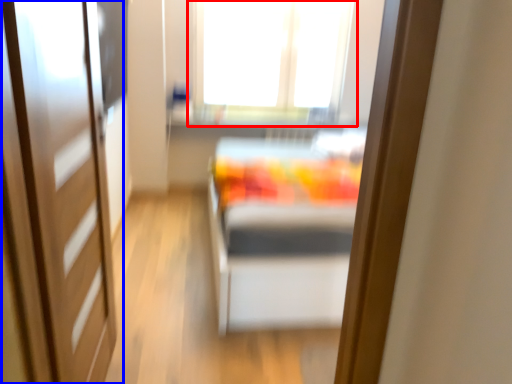
Question: Which object is closer to the camera taking this photo, window (highlighted by a red box) or door (highlighted by a blue box)?

Choices:
 (A) window
 (B) door

Answer: (B)